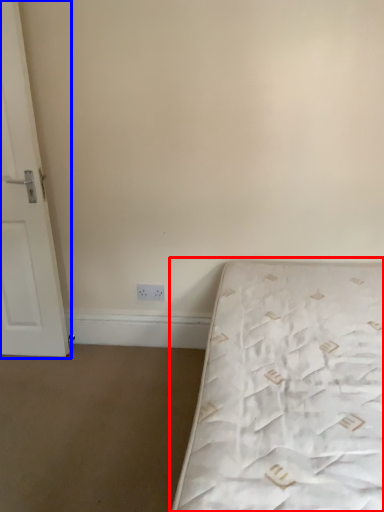
Question: Among these objects, which one is farthest to the camera, bed (highlighted by a red box) or door (highlighted by a blue box)?

Choices:
 (A) bed
 (B) door

Answer: (B)